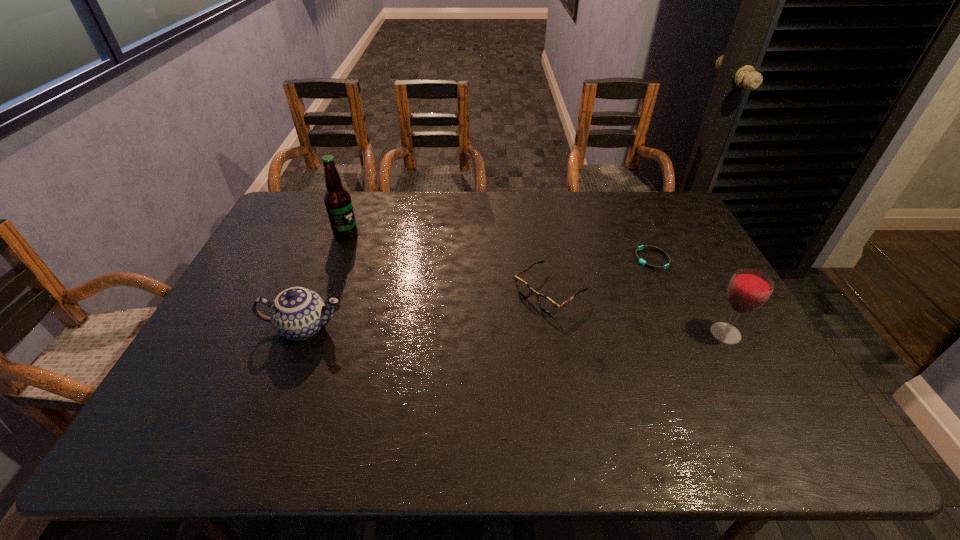
What are the coordinates of `the third tallest object` in the screenshot? It's located at (x=297, y=313).

The height and width of the screenshot is (540, 960). In order to click on the fourth shortest object in this screenshot , I will do `click(749, 289)`.

The height and width of the screenshot is (540, 960). Find the location of `the rightmost object`. the rightmost object is located at coordinates (749, 289).

This screenshot has width=960, height=540. I want to click on the shortest object, so 642,262.

The width and height of the screenshot is (960, 540). Identify the location of wristband. (642, 262).

You are a GUI agent. You are given a task and a screenshot of the screen. Output one action in this format:
    pyautogui.click(x=<x>, y=<y>)
    Task: Click on the third object from left to right
    The height and width of the screenshot is (540, 960).
    Given the screenshot: What is the action you would take?
    pyautogui.click(x=546, y=304)

This screenshot has width=960, height=540. I want to click on spectacles, so click(546, 304).

This screenshot has height=540, width=960. I want to click on beer bottle, so click(337, 200).

The width and height of the screenshot is (960, 540). I want to click on the tallest object, so click(x=337, y=200).

Where is `vacant space positioned at the spout of the third tallest object`? The width and height of the screenshot is (960, 540). vacant space positioned at the spout of the third tallest object is located at coordinates (376, 328).